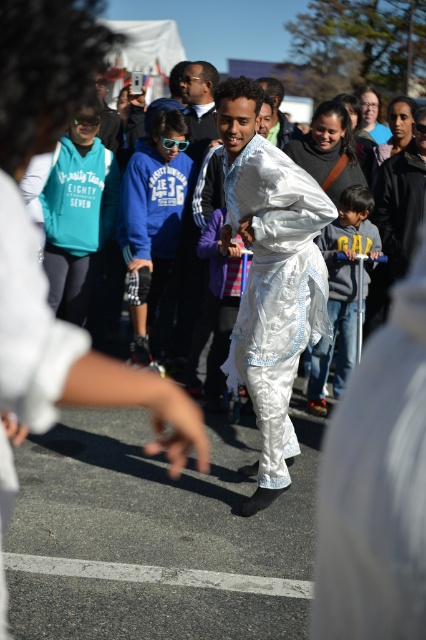
Can you confirm if shiny silver robe at center is positioned to the right of blue fleece hoodie at center?

Indeed, shiny silver robe at center is positioned on the right side of blue fleece hoodie at center.

Based on the photo, can you confirm if shiny silver robe at center is wider than blue fleece hoodie at center?

Yes.

Where is `shiny silver robe at center`? This screenshot has height=640, width=426. shiny silver robe at center is located at coordinates (270, 275).

Can you confirm if shiny silver robe at center is smaller than dark gray sweater at center?

No.

Between shiny silver robe at center and dark gray sweater at center, which one has more height?

shiny silver robe at center is taller.

The image size is (426, 640). What do you see at coordinates (270, 275) in the screenshot? I see `shiny silver robe at center` at bounding box center [270, 275].

Identify the location of shiny silver robe at center. (270, 275).

Between point (149, 221) and point (336, 371), which one is positioned behind?

Point (149, 221)

Can you confirm if blue fleece hoodie at center is shorter than dark gray sweater at center?

Incorrect, blue fleece hoodie at center's height does not fall short of dark gray sweater at center's.

Who is more forward, (160,202) or (336,330)?

Point (336,330) is more forward.

At what (x,y) coordinates should I click in order to perform the action: click on blue fleece hoodie at center. Please return your answer as a coordinate pair (x, y). Image resolution: width=426 pixels, height=640 pixels. Looking at the image, I should click on (152, 220).